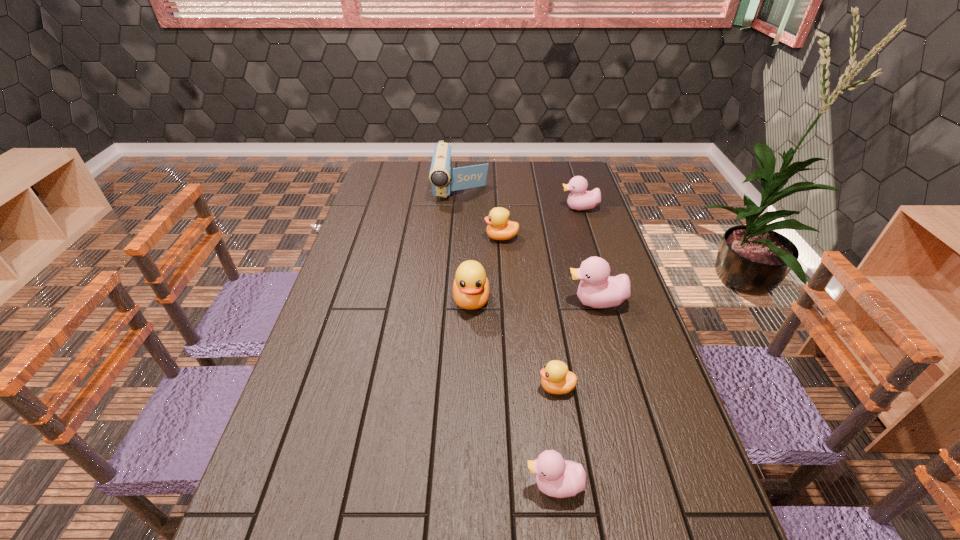
At what (x,y) coordinates should I click in order to perform the action: click on the fifth closest object to the second biggest yellow duckling. Please return your answer as a coordinate pair (x, y). This screenshot has width=960, height=540. Looking at the image, I should click on (556, 379).

This screenshot has height=540, width=960. I want to click on object that is the fourth closest one to the second farthest pink duckling, so click(579, 199).

Locate which duckling ranks third in proximity to the second farthest yellow duckling. Please provide its 2D coordinates. Your answer should be formatted as a tuple, i.e. [(x, y)], where the tuple contains the x and y coordinates of a point satisfying the conditions above.

[(556, 379)]

Locate which duckling is the fifth closest to the second farthest yellow duckling. Please provide its 2D coordinates. Your answer should be formatted as a tuple, i.e. [(x, y)], where the tuple contains the x and y coordinates of a point satisfying the conditions above.

[(579, 199)]

The width and height of the screenshot is (960, 540). Find the location of `pink duckling that stands as the second closest to the second nearest pink duckling`. pink duckling that stands as the second closest to the second nearest pink duckling is located at coordinates (556, 477).

Choose which pink duckling is the nearest neighbor to the farthest yellow duckling. Please provide its 2D coordinates. Your answer should be formatted as a tuple, i.e. [(x, y)], where the tuple contains the x and y coordinates of a point satisfying the conditions above.

[(579, 199)]

The height and width of the screenshot is (540, 960). Find the location of `yellow duckling that is the second closest one to the camcorder`. yellow duckling that is the second closest one to the camcorder is located at coordinates (471, 288).

The width and height of the screenshot is (960, 540). In order to click on yellow duckling that is the third closest to the second smallest pink duckling in this screenshot , I will do `click(556, 379)`.

This screenshot has width=960, height=540. Identify the location of vacant region that satisfies the following two spatial constraints: 1. on the front-facing side of the farthest duckling; 2. on the face of the biggest yellow duckling. point(609,300).